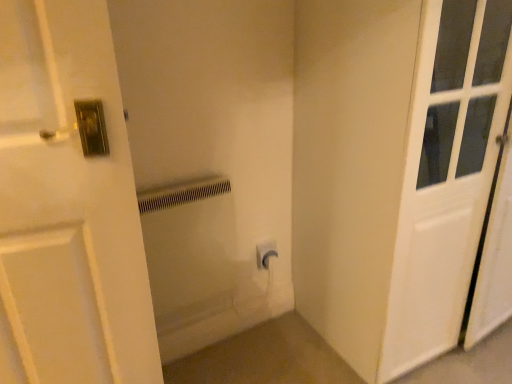
Question: Considering the relative sizes of white plastic radiator at center and white plastic electric outlet at center in the image provided, is white plastic radiator at center taller than white plastic electric outlet at center?

Choices:
 (A) yes
 (B) no

Answer: (A)

Question: From the image's perspective, is white plastic radiator at center located beneath white plastic electric outlet at center?

Choices:
 (A) yes
 (B) no

Answer: (A)

Question: Does white plastic radiator at center have a smaller size compared to white plastic electric outlet at center?

Choices:
 (A) yes
 (B) no

Answer: (B)

Question: Does white plastic radiator at center have a greater width compared to white plastic electric outlet at center?

Choices:
 (A) no
 (B) yes

Answer: (B)

Question: Is white plastic radiator at center positioned far away from white plastic electric outlet at center?

Choices:
 (A) yes
 (B) no

Answer: (B)

Question: From their relative heights in the image, would you say white plastic electric outlet at center is taller or shorter than white plastic radiator at center?

Choices:
 (A) short
 (B) tall

Answer: (A)

Question: From a real-world perspective, is white plastic electric outlet at center physically located above or below white plastic radiator at center?

Choices:
 (A) above
 (B) below

Answer: (B)

Question: Relative to white plastic radiator at center, is white plastic electric outlet at center in front or behind?

Choices:
 (A) front
 (B) behind

Answer: (B)

Question: From the image's perspective, is white plastic electric outlet at center above or below white plastic radiator at center?

Choices:
 (A) below
 (B) above

Answer: (B)

Question: Relative to white plastic electric outlet at center, is white matte door at right in front or behind?

Choices:
 (A) front
 (B) behind

Answer: (A)

Question: Considering the positions of white matte door at right and white plastic electric outlet at center in the image, is white matte door at right taller or shorter than white plastic electric outlet at center?

Choices:
 (A) short
 (B) tall

Answer: (B)

Question: Is point (461, 183) closer or farther from the camera than point (258, 243)?

Choices:
 (A) closer
 (B) farther

Answer: (A)

Question: From a real-world perspective, is white matte door at right above or below white plastic electric outlet at center?

Choices:
 (A) above
 (B) below

Answer: (A)

Question: Considering the positions of white plastic radiator at center and white matte door at right in the image, is white plastic radiator at center taller or shorter than white matte door at right?

Choices:
 (A) tall
 (B) short

Answer: (B)

Question: From a real-world perspective, is white plastic radiator at center positioned above or below white matte door at right?

Choices:
 (A) above
 (B) below

Answer: (B)